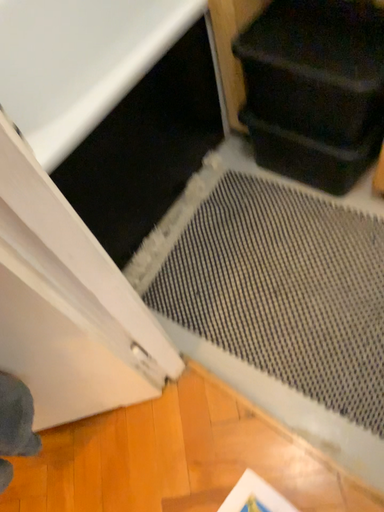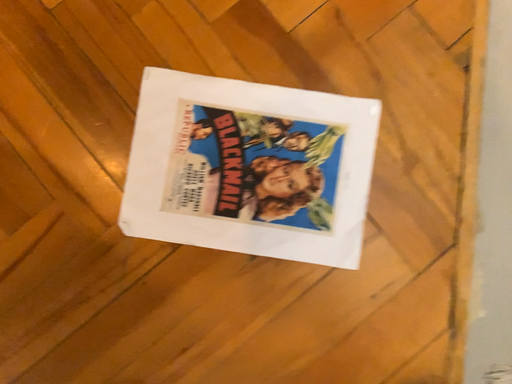
Question: Which way did the camera rotate in the video?

Choices:
 (A) rotated left
 (B) rotated right

Answer: (A)